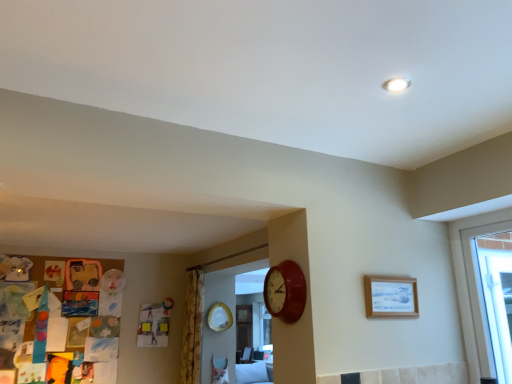
Question: Is yellow floral fabric curtain at center surrounded by wooden picture frame at upper right?

Choices:
 (A) yes
 (B) no

Answer: (B)

Question: Is wooden picture frame at upper right shorter than yellow floral fabric curtain at center?

Choices:
 (A) yes
 (B) no

Answer: (A)

Question: Is wooden picture frame at upper right completely or partially outside of yellow floral fabric curtain at center?

Choices:
 (A) yes
 (B) no

Answer: (A)

Question: Is wooden picture frame at upper right directly adjacent to yellow floral fabric curtain at center?

Choices:
 (A) yes
 (B) no

Answer: (B)

Question: Considering the relative positions of wooden picture frame at upper right and yellow floral fabric curtain at center in the image provided, is wooden picture frame at upper right to the left of yellow floral fabric curtain at center from the viewer's perspective?

Choices:
 (A) no
 (B) yes

Answer: (A)

Question: Can you confirm if wooden picture frame at upper right is positioned to the right of yellow floral fabric curtain at center?

Choices:
 (A) yes
 (B) no

Answer: (A)

Question: Considering the relative sizes of wooden picture frame at upper right and matte red clock at center in the image provided, is wooden picture frame at upper right thinner than matte red clock at center?

Choices:
 (A) yes
 (B) no

Answer: (A)

Question: Is wooden picture frame at upper right positioned behind matte red clock at center?

Choices:
 (A) no
 (B) yes

Answer: (B)

Question: From the image's perspective, is wooden picture frame at upper right over matte red clock at center?

Choices:
 (A) yes
 (B) no

Answer: (B)

Question: From a real-world perspective, is wooden picture frame at upper right physically below matte red clock at center?

Choices:
 (A) yes
 (B) no

Answer: (A)

Question: Does wooden picture frame at upper right have a greater width compared to matte red clock at center?

Choices:
 (A) no
 (B) yes

Answer: (A)

Question: Can you confirm if wooden picture frame at upper right is smaller than matte red clock at center?

Choices:
 (A) no
 (B) yes

Answer: (B)

Question: Considering the relative sizes of yellow floral fabric curtain at center and matte red clock at center in the image provided, is yellow floral fabric curtain at center wider than matte red clock at center?

Choices:
 (A) no
 (B) yes

Answer: (B)